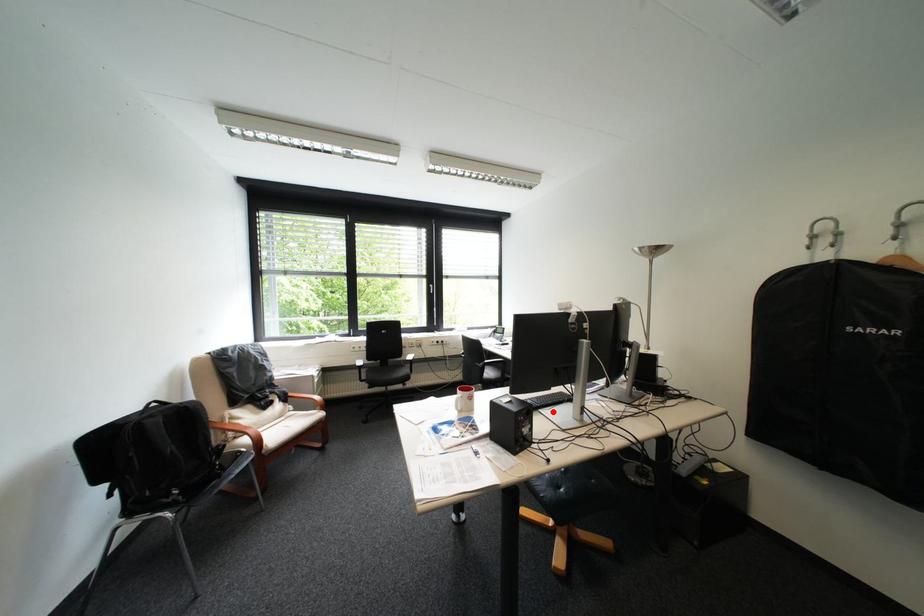
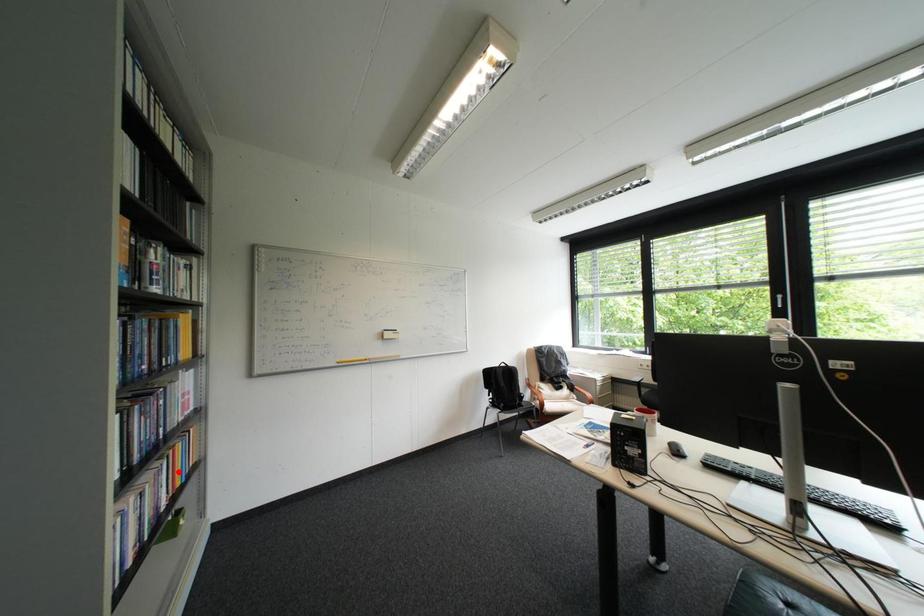
I am providing you with two images of the same scene from different viewpoints. A red point is marked on the first image and another point is marked on the second image. Is the marked point in image1 the same physical position as the marked point in image2?

No